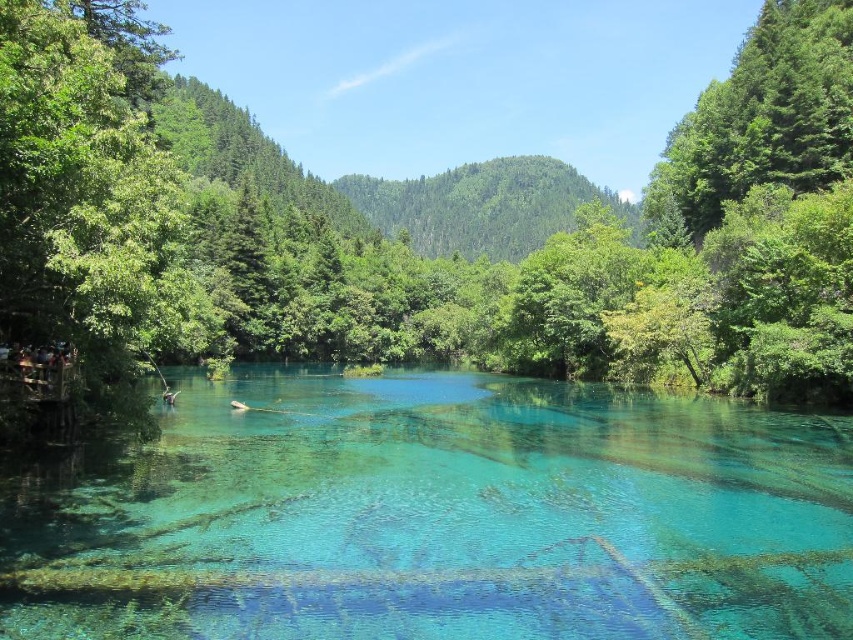
Question: Among these points, which one is farthest from the camera?

Choices:
 (A) (161, 300)
 (B) (102, 323)
 (C) (74, 499)
 (D) (846, 156)

Answer: (D)

Question: Can you confirm if green leafy tree at center is positioned below translucent blue water at center?

Choices:
 (A) no
 (B) yes

Answer: (A)

Question: Does green leafy tree at left appear on the right side of green leafy tree at upper right?

Choices:
 (A) no
 (B) yes

Answer: (A)

Question: Does green leafy tree at center lie in front of green leafy tree at left?

Choices:
 (A) yes
 (B) no

Answer: (B)

Question: Which object is closer to the camera taking this photo?

Choices:
 (A) green leafy tree at upper right
 (B) green leafy tree at center
 (C) green leafy tree at left

Answer: (C)

Question: Which point appears farthest from the camera in this image?

Choices:
 (A) tap(126, 116)
 (B) tap(386, 513)
 (C) tap(785, 147)
 (D) tap(757, 99)

Answer: (D)